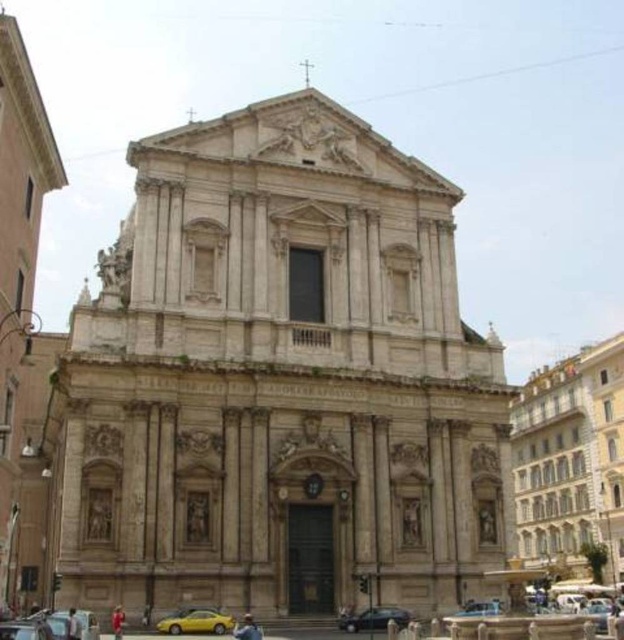
You are a pedestrian standing in front of the grand classical church and want to cross the street. You see a yellow matte car at lower center and a yellow metallic car at lower left. Which car is closer to you?

The yellow matte car at lower center is closer to you because it is further to the viewer than the yellow metallic car at lower left.

You are standing in front of the beige stone church at center. What are the coordinates of the church in the image?

The beige stone church at center is located at coordinates point (280, 381).